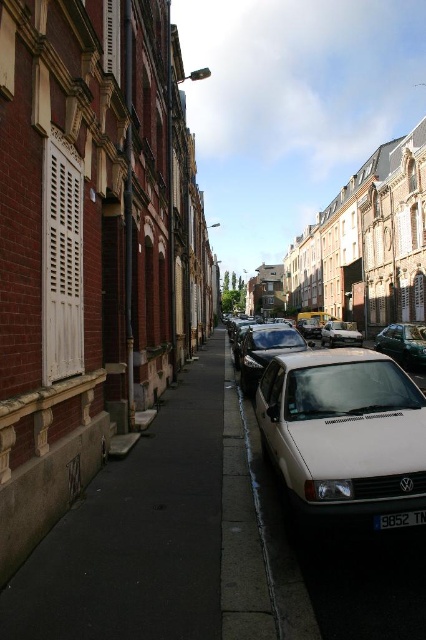
Question: Can you confirm if silver metallic van at center is smaller than black plastic license plate at center?

Choices:
 (A) no
 (B) yes

Answer: (A)

Question: Which point is closer to the camera?

Choices:
 (A) silver metallic van at center
 (B) shiny black car at center
 (C) shiny silver car at center
 (D) black plastic license plate at center

Answer: (D)

Question: Can you confirm if shiny black car at center is positioned below black plastic license plate at center?

Choices:
 (A) no
 (B) yes

Answer: (A)

Question: Which point appears closest to the camera in this image?

Choices:
 (A) click(x=409, y=518)
 (B) click(x=282, y=470)
 (C) click(x=344, y=337)
 (D) click(x=253, y=349)

Answer: (A)

Question: Is shiny silver car at center in front of shiny black car at center?

Choices:
 (A) yes
 (B) no

Answer: (A)

Question: Which object appears farthest from the camera in this image?

Choices:
 (A) silver metallic van at center
 (B) shiny black car at center

Answer: (A)